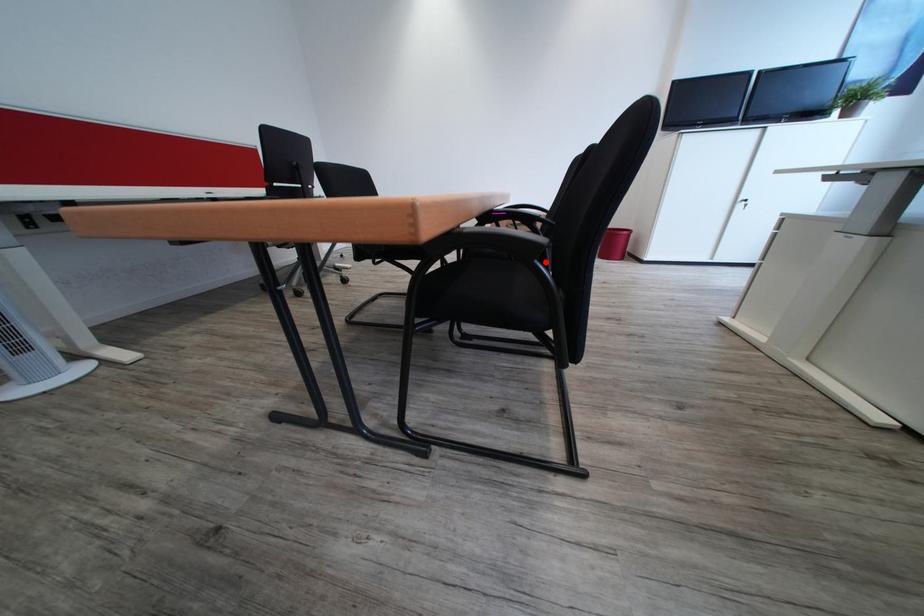
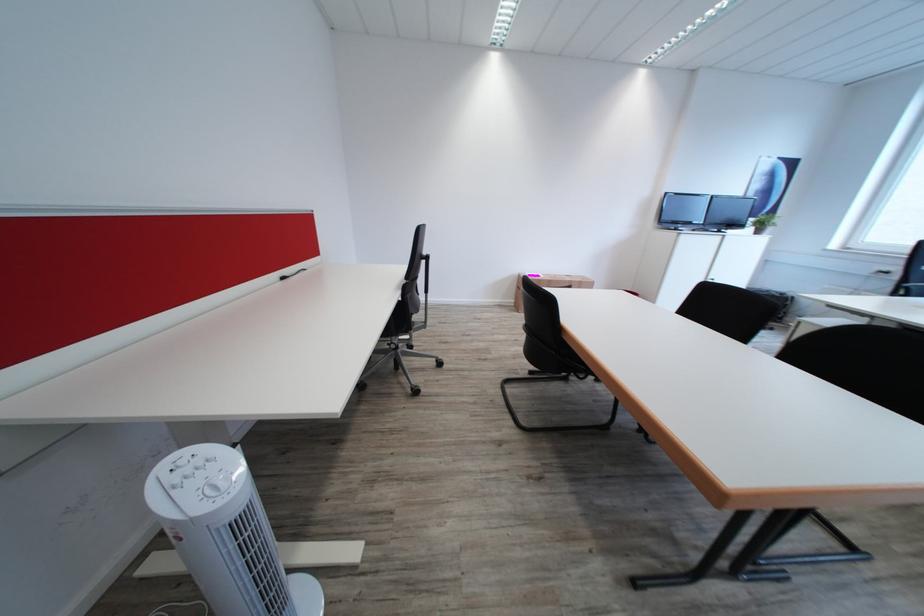
Question: I am providing you with two images of the same scene from different viewpoints. A red point is marked on the first image. Is the red point's position out of view in image 2?

Choices:
 (A) Yes
 (B) No

Answer: (A)